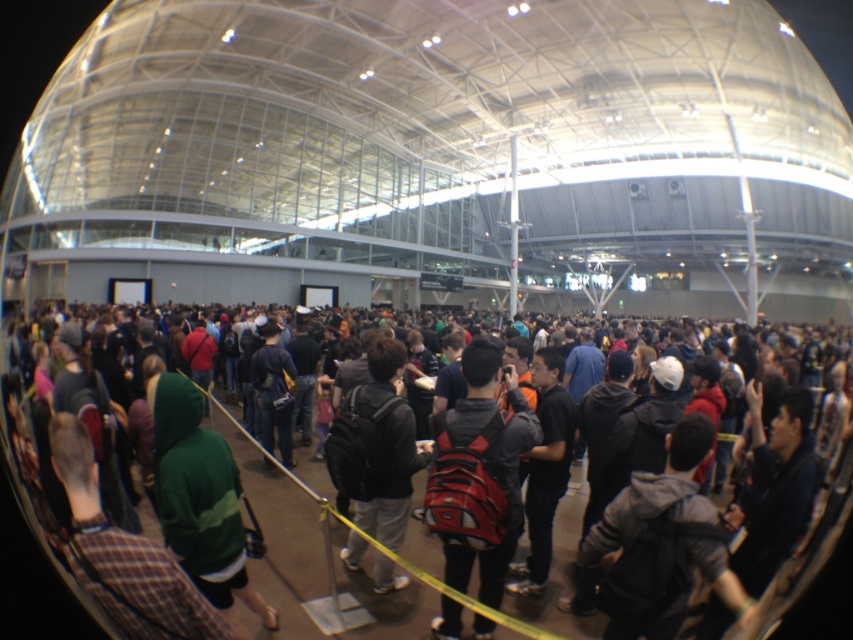
You are a photographer positioned at the back of the event hall. You want to take a photo of the dark green hoodie at center without moving closer. Can you do so with a standard camera lens that has a 50mm focal length?

The dark green hoodie at center is 1.86 meters away from the viewer. A standard 50mm lens has a moderate field of view, so it should be possible to capture the dark green hoodie at center in the frame without moving closer, provided the photographer adjusts their position slightly for composition.